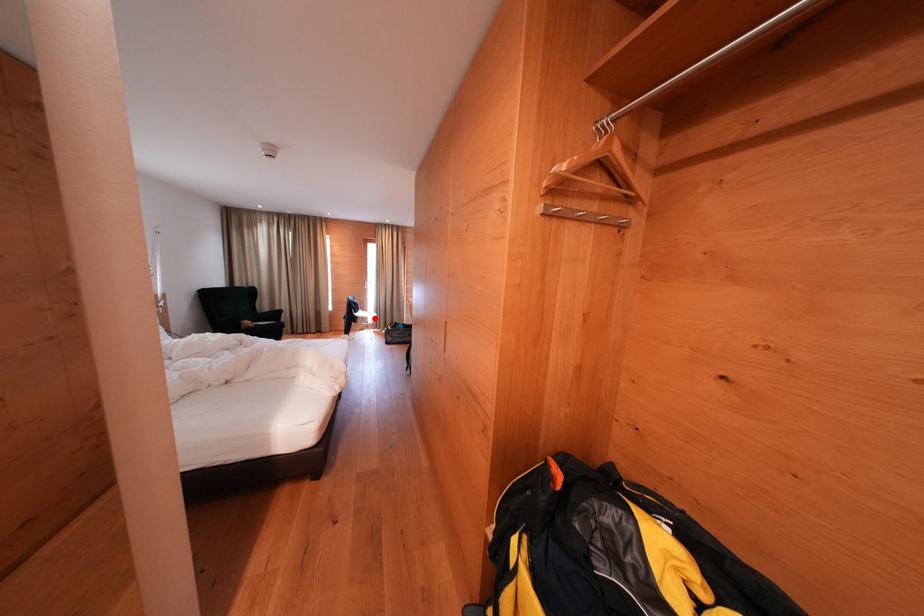
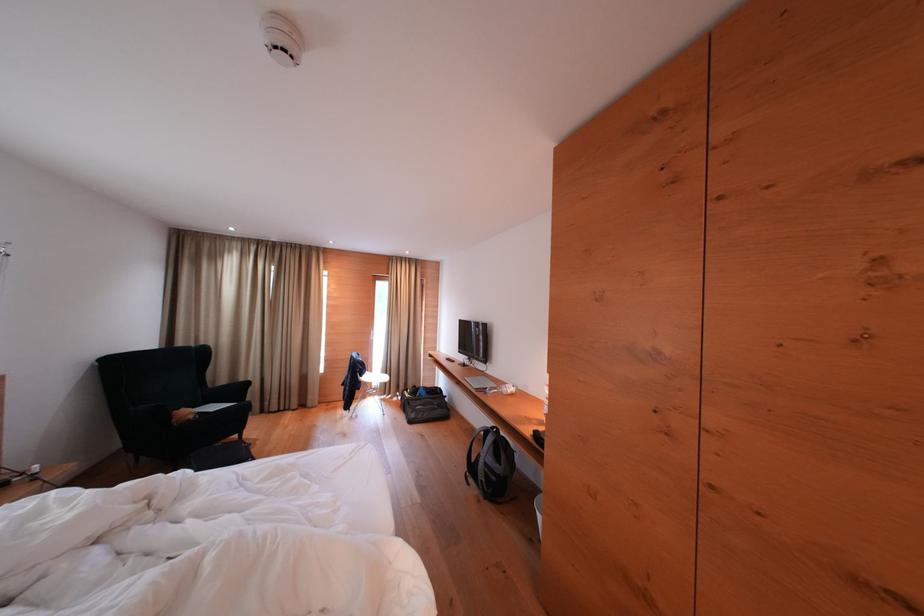
In the second image, find the point that corresponds to the highlighted location in the first image.

(383, 379)